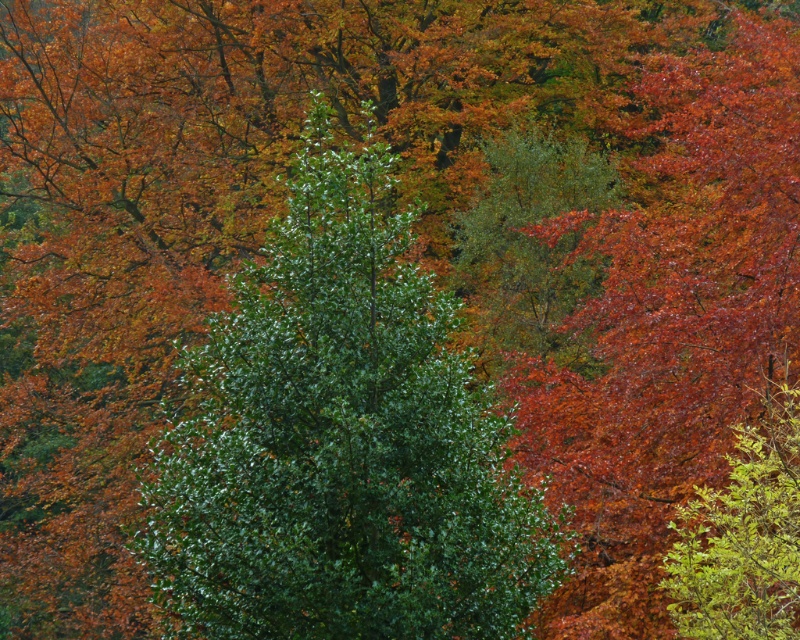
Question: Does green glossy tree at center appear under green leafy shrub at right?

Choices:
 (A) no
 (B) yes

Answer: (B)

Question: Which of the following is the closest to the observer?

Choices:
 (A) green glossy tree at center
 (B) green leafy shrub at right

Answer: (B)

Question: Among these points, which one is farthest from the camera?

Choices:
 (A) (504, 417)
 (B) (698, 586)

Answer: (A)

Question: Does green glossy tree at center have a greater width compared to green leafy shrub at right?

Choices:
 (A) yes
 (B) no

Answer: (B)

Question: Is green glossy tree at center behind green leafy shrub at right?

Choices:
 (A) yes
 (B) no

Answer: (A)